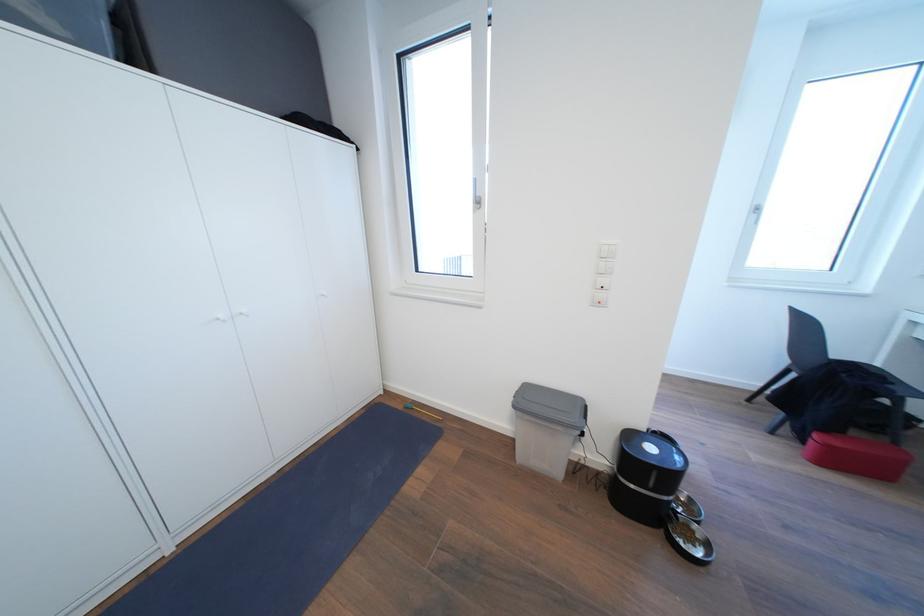
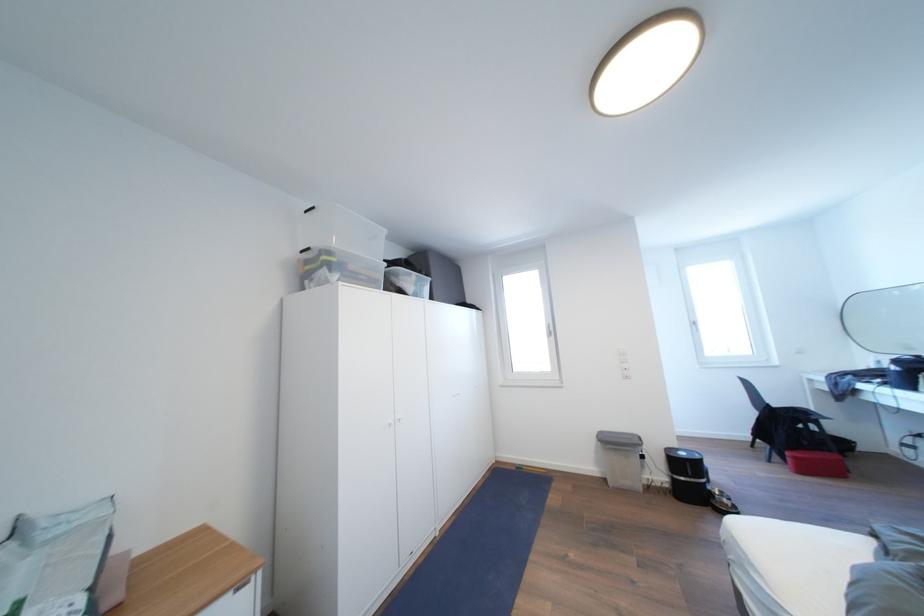
Where in the second image is the point corresponding to (x=408, y=411) from the first image?

(521, 472)